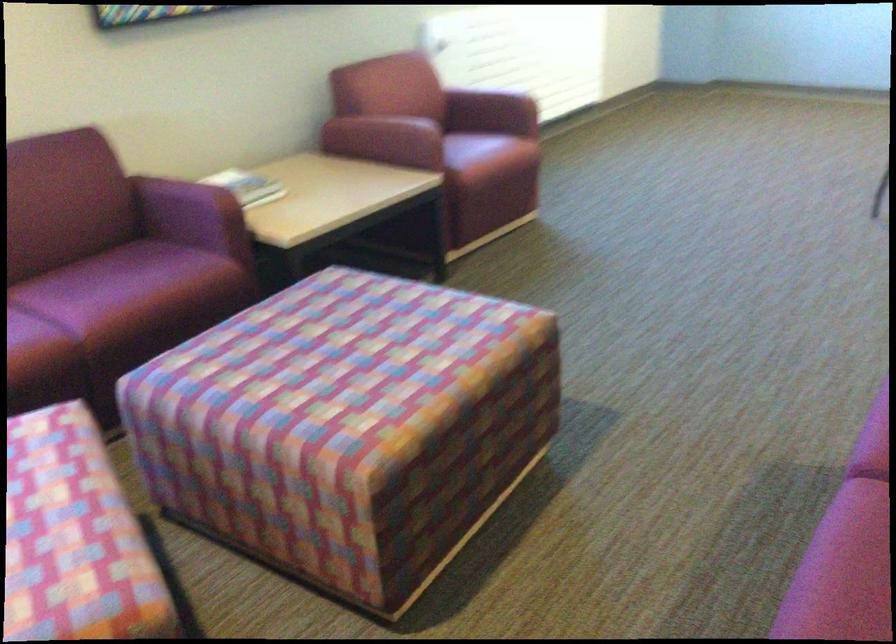
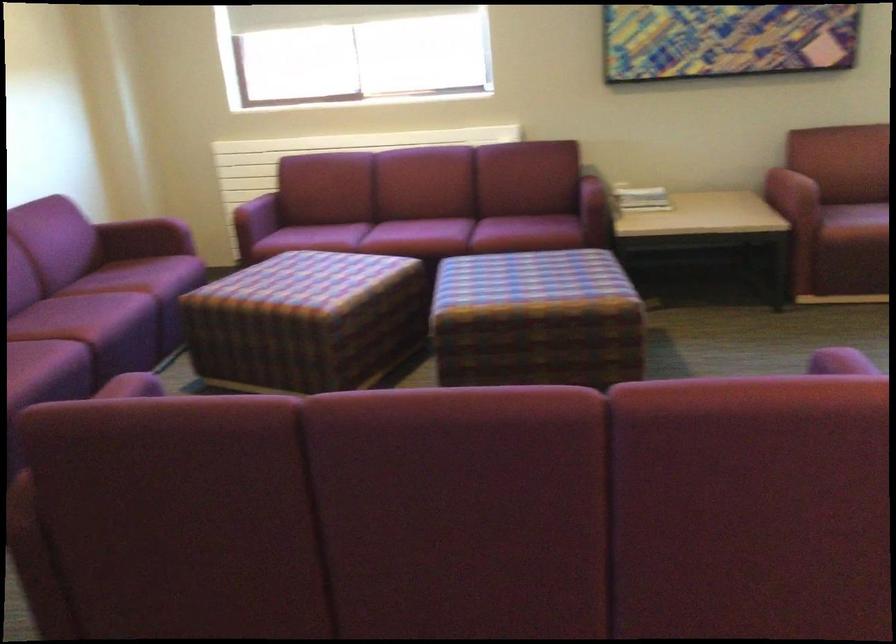
Find the pixel in the second image that matches pixel 424 147 in the first image.

(791, 194)